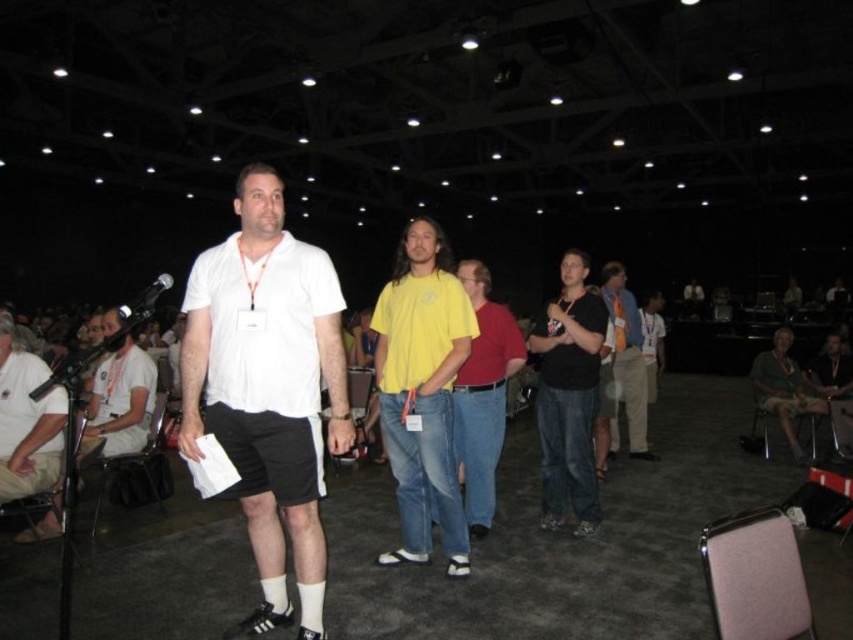
Can you confirm if black matte shirt at center is taller than black metallic microphone at left?

Yes.

Can you confirm if black matte shirt at center is positioned below black metallic microphone at left?

Indeed, black matte shirt at center is positioned under black metallic microphone at left.

At what (x,y) coordinates should I click in order to perform the action: click on black matte shirt at center. Please return your answer as a coordinate pair (x, y). Looking at the image, I should click on (x=567, y=396).

Is point (407, 243) more distant than point (466, 365)?

No, it is in front of (466, 365).

Identify the location of yellow cotton t-shirt at center. (422, 392).

Measure the distance between yellow cotton t-shirt at center and camera.

yellow cotton t-shirt at center is 12.09 feet from camera.

Locate an element on the screen. yellow cotton t-shirt at center is located at coordinates pos(422,392).

Is point (595, 497) behind point (105, 339)?

That is True.

Is black matte shirt at center to the right of matte white shirt at left from the viewer's perspective?

Correct, you'll find black matte shirt at center to the right of matte white shirt at left.

This screenshot has width=853, height=640. Identify the location of black matte shirt at center. (567, 396).